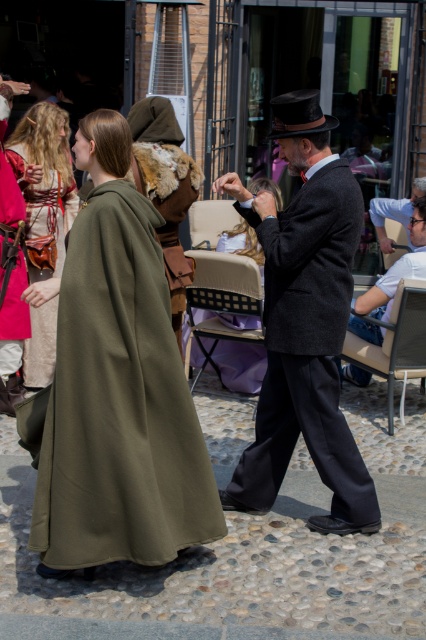
Who is positioned more to the left, olive woolen cape at center or dark gray wool suit at center?

olive woolen cape at center is more to the left.

Does point (39, 531) come closer to viewer compared to point (268, 492)?

Yes, it is in front of point (268, 492).

Is point (60, 392) closer to camera compared to point (339, 522)?

That is True.

Locate an element on the screen. olive woolen cape at center is located at coordinates (118, 387).

Can you confirm if dark gray wool suit at center is taller than matte green cloak at left?

Yes, dark gray wool suit at center is taller than matte green cloak at left.

Is dark gray wool suit at center positioned at the back of matte green cloak at left?

No.

Image resolution: width=426 pixels, height=640 pixels. What do you see at coordinates (305, 321) in the screenshot?
I see `dark gray wool suit at center` at bounding box center [305, 321].

This screenshot has height=640, width=426. In order to click on dark gray wool suit at center in this screenshot , I will do `click(305, 321)`.

Does olive woolen cape at center come behind smooth gray suit at center?

No.

Between olive woolen cape at center and smooth gray suit at center, which one has less height?

With less height is smooth gray suit at center.

Which is in front, point (129, 417) or point (371, 205)?

Point (129, 417)

Locate an element on the screen. Image resolution: width=426 pixels, height=640 pixels. olive woolen cape at center is located at coordinates (118, 387).